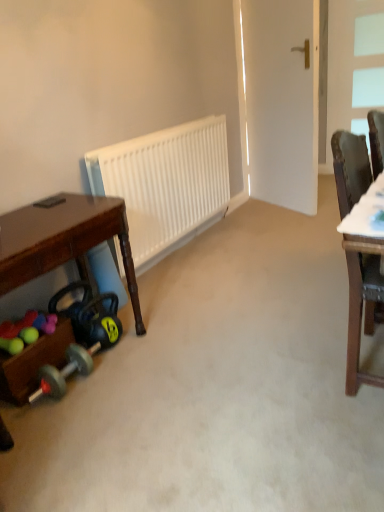
Question: Considering the positions of white glass window at upper right and white matte radiator at center in the image, is white glass window at upper right wider or thinner than white matte radiator at center?

Choices:
 (A) thin
 (B) wide

Answer: (A)

Question: In terms of height, does white glass window at upper right look taller or shorter compared to white matte radiator at center?

Choices:
 (A) tall
 (B) short

Answer: (A)

Question: Which of these objects is positioned farthest from the wooden toy box at lower left?

Choices:
 (A) white glass window at upper right
 (B) brown wood chair at right
 (C) white matte radiator at center
 (D) brown wooden desk at lower left
 (E) rubberized plastic balls at lower left

Answer: (A)

Question: Estimate the real-world distances between objects in this image. Which object is farther from the brown wood chair at right?

Choices:
 (A) wooden toy box at lower left
 (B) white glass window at upper right
 (C) rubberized plastic balls at lower left
 (D) white matte radiator at center
 (E) brown wooden desk at lower left

Answer: (B)